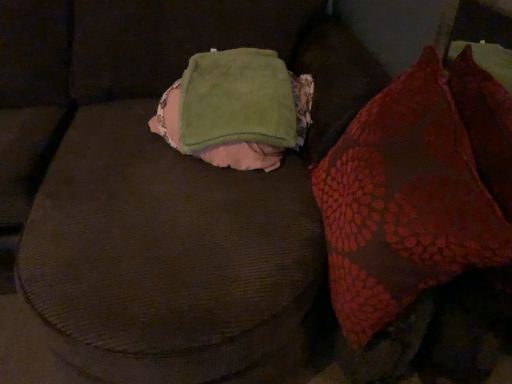
Question: Based on their positions, is velvet red pillow at right located to the left or right of green soft blanket at center?

Choices:
 (A) right
 (B) left

Answer: (A)

Question: From a real-world perspective, is velvet red pillow at right physically located above or below green soft blanket at center?

Choices:
 (A) below
 (B) above

Answer: (A)

Question: Considering the positions of velvet red pillow at right and green soft blanket at center in the image, is velvet red pillow at right wider or thinner than green soft blanket at center?

Choices:
 (A) thin
 (B) wide

Answer: (A)

Question: Is green soft blanket at center in front of or behind velvet red pillow at right in the image?

Choices:
 (A) behind
 (B) front

Answer: (A)

Question: Is green soft blanket at center wider or thinner than velvet red pillow at right?

Choices:
 (A) wide
 (B) thin

Answer: (A)

Question: Would you say green soft blanket at center is inside or outside velvet red pillow at right?

Choices:
 (A) outside
 (B) inside

Answer: (A)

Question: Considering the positions of green soft blanket at center and velvet red pillow at right in the image, is green soft blanket at center taller or shorter than velvet red pillow at right?

Choices:
 (A) short
 (B) tall

Answer: (A)